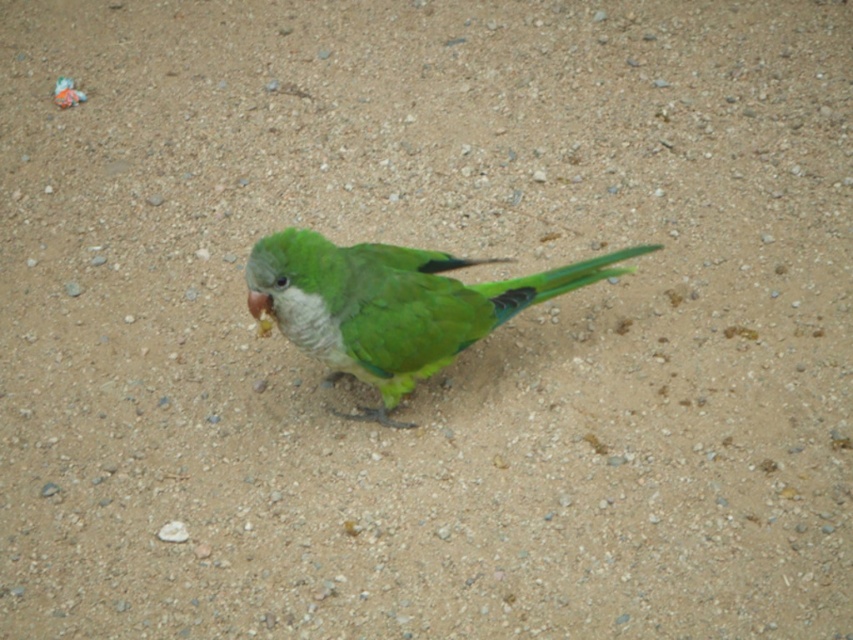
Who is lower down, green matte parrot at center or matte yellow beak at center?

Result: Positioned lower is green matte parrot at center.

Does point (303, 291) come closer to viewer compared to point (251, 300)?

No, (303, 291) is behind (251, 300).

Does point (354, 275) come closer to viewer compared to point (262, 292)?

That is False.

You are a GUI agent. You are given a task and a screenshot of the screen. Output one action in this format:
    pyautogui.click(x=<x>, y=<y>)
    Task: Click on the green matte parrot at center
    This screenshot has height=640, width=853.
    Given the screenshot: What is the action you would take?
    pyautogui.click(x=393, y=305)